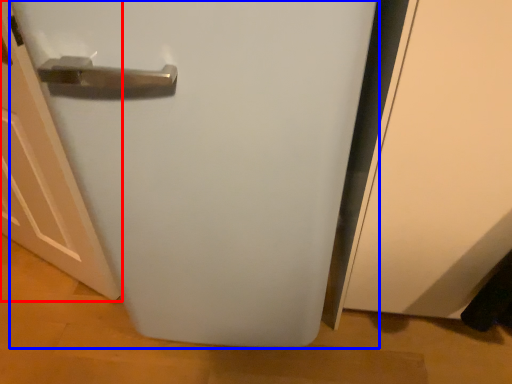
Question: Which of the following is the closest to the observer, door (highlighted by a red box) or refrigerator (highlighted by a blue box)?

Choices:
 (A) door
 (B) refrigerator

Answer: (B)